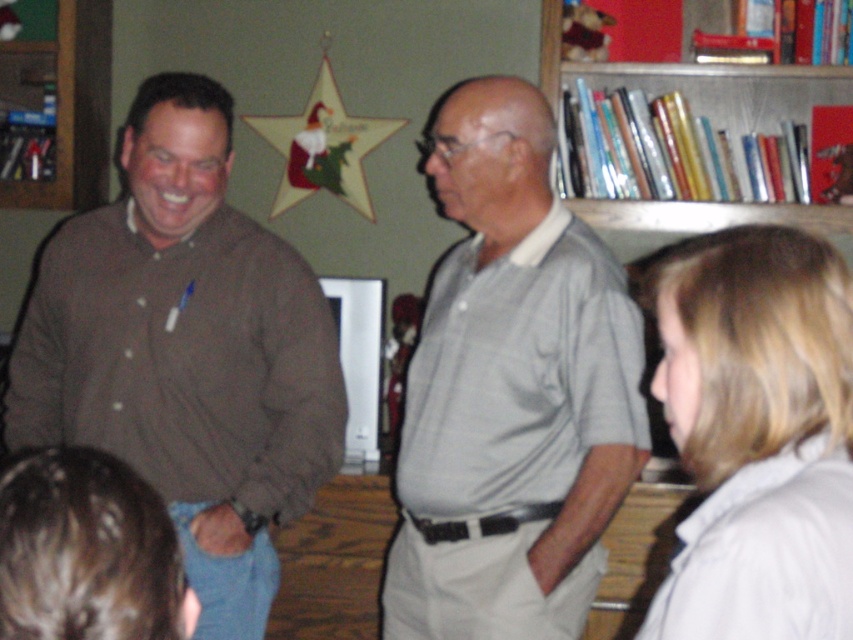
Is point (102, 426) positioned before point (613, 221)?

Yes.

Is brown cotton shirt at left positioned behind metallic silver books at upper right?

No, brown cotton shirt at left is closer to the viewer.

Where is `brown cotton shirt at left`? brown cotton shirt at left is located at coordinates (186, 352).

Who is higher up, gray cotton shirt at center or metallic silver books at upper right?

Positioned higher is metallic silver books at upper right.

Can you confirm if gray cotton shirt at center is positioned below metallic silver books at upper right?

Yes, gray cotton shirt at center is below metallic silver books at upper right.

Who is more forward, (485, 324) or (705, 81)?

Point (485, 324)

I want to click on gray cotton shirt at center, so click(x=509, y=390).

Does point (189, 424) come behind point (648, 616)?

Yes, it is.

Based on the photo, between brown cotton shirt at left and blonde hair at lower right, which one is positioned higher?

brown cotton shirt at left is higher up.

Is point (74, 346) more distant than point (730, 330)?

That is True.

Locate an element on the screen. The image size is (853, 640). brown cotton shirt at left is located at coordinates click(x=186, y=352).